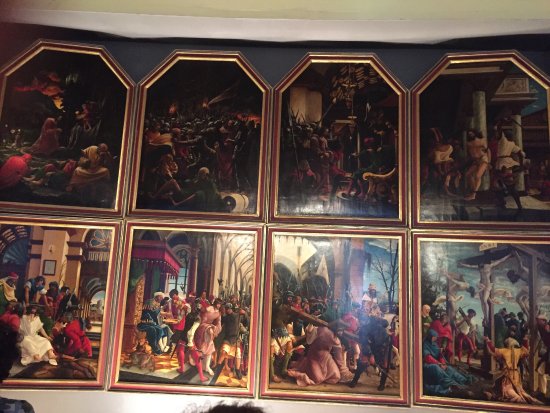
Locate an element on the screen. This screenshot has width=550, height=413. picture is located at coordinates (437, 212).